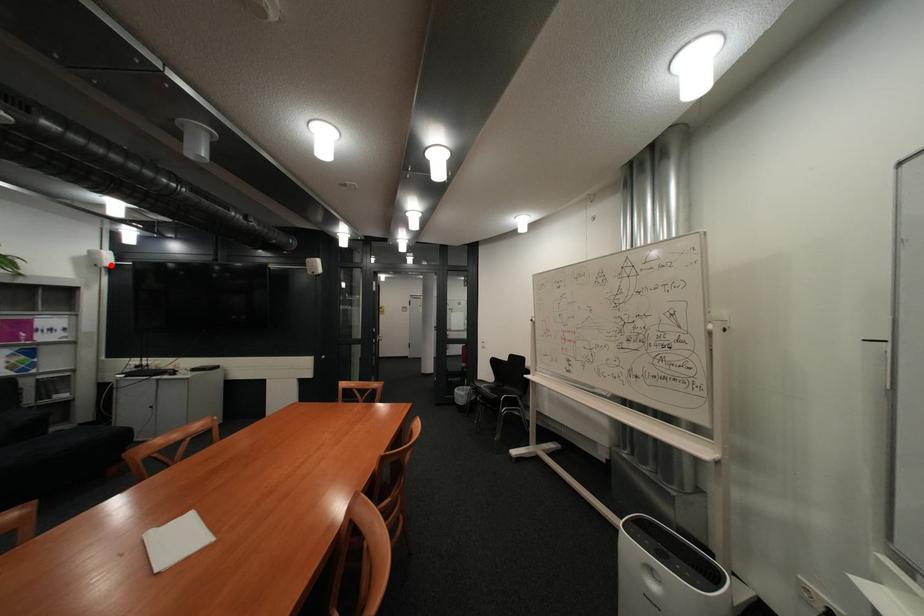
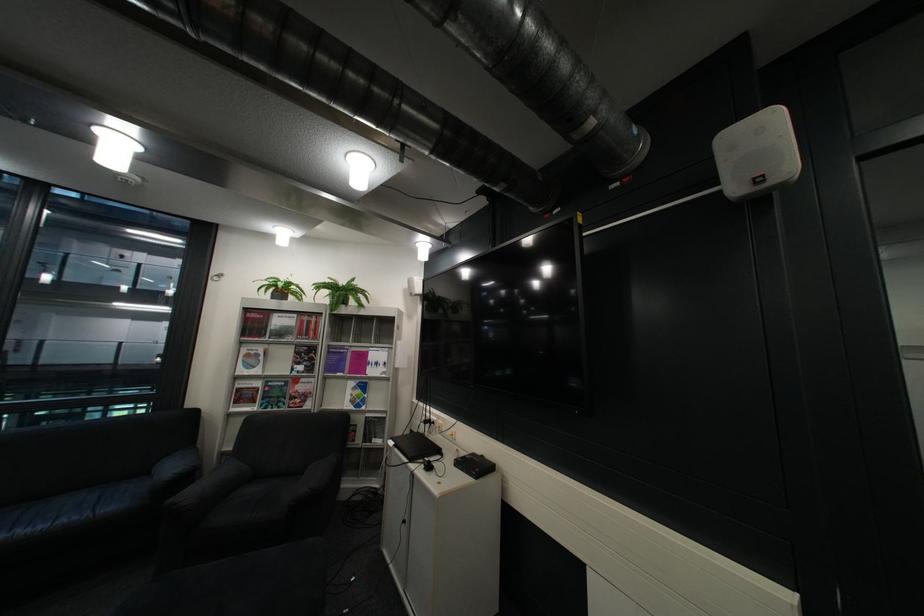
The point at the highlighted location is marked in the first image. Where is the corresponding point in the second image?

(427, 294)